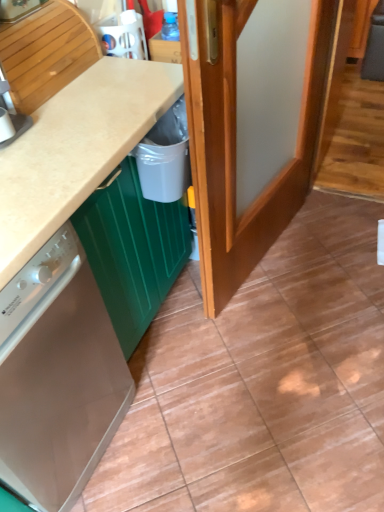
Find the location of a particular element. This screenshot has width=384, height=512. vacant area located to the right-hand side of satin white dishwasher at lower left is located at coordinates (182, 416).